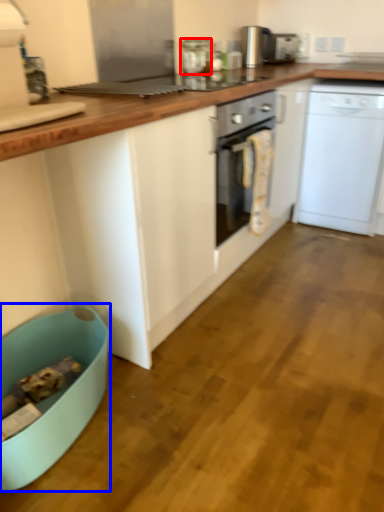
Question: Which of the following is the closest to the observer, kitchen appliance (highlighted by a red box) or dish washer (highlighted by a blue box)?

Choices:
 (A) kitchen appliance
 (B) dish washer

Answer: (B)